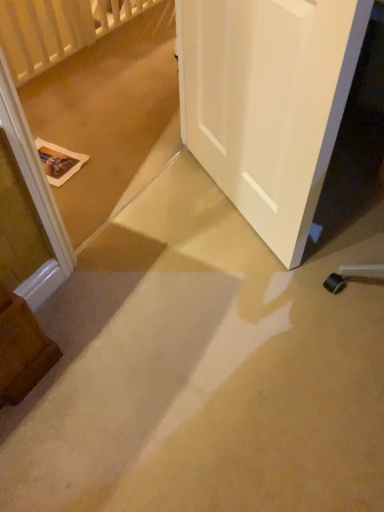
Question: From a real-world perspective, is white matte door at center physically below white wooden balustrade at upper left?

Choices:
 (A) yes
 (B) no

Answer: (B)

Question: Is white matte door at center positioned before white wooden balustrade at upper left?

Choices:
 (A) no
 (B) yes

Answer: (B)

Question: Would you say white matte door at center is a long distance from white wooden balustrade at upper left?

Choices:
 (A) yes
 (B) no

Answer: (A)

Question: Are white matte door at center and white wooden balustrade at upper left making contact?

Choices:
 (A) no
 (B) yes

Answer: (A)

Question: Is white matte door at center looking in the opposite direction of white wooden balustrade at upper left?

Choices:
 (A) yes
 (B) no

Answer: (B)

Question: Considering the relative sizes of white matte door at center and white wooden balustrade at upper left in the image provided, is white matte door at center thinner than white wooden balustrade at upper left?

Choices:
 (A) no
 (B) yes

Answer: (B)

Question: Is white wooden balustrade at upper left aimed at white matte door at center?

Choices:
 (A) yes
 (B) no

Answer: (A)

Question: Would you say white wooden balustrade at upper left contains white matte door at center?

Choices:
 (A) yes
 (B) no

Answer: (B)

Question: Is white wooden balustrade at upper left taller than white matte door at center?

Choices:
 (A) no
 (B) yes

Answer: (A)

Question: Can you confirm if white wooden balustrade at upper left is thinner than white matte door at center?

Choices:
 (A) no
 (B) yes

Answer: (A)

Question: Can you confirm if white wooden balustrade at upper left is bigger than white matte door at center?

Choices:
 (A) yes
 (B) no

Answer: (A)

Question: Is white wooden balustrade at upper left closer to the viewer compared to white matte door at center?

Choices:
 (A) no
 (B) yes

Answer: (A)

Question: Does white wooden balustrade at upper left come behind beige carpet at lower center?

Choices:
 (A) yes
 (B) no

Answer: (A)